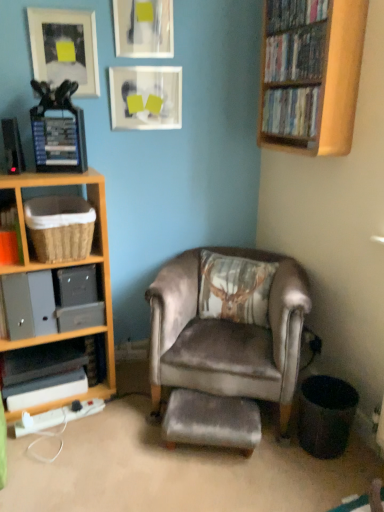
Question: Looking at the image, does wooden bookshelf at upper right seem bigger or smaller compared to woven brown basket at left, the first shelf in the top-to-bottom sequence?

Choices:
 (A) big
 (B) small

Answer: (A)

Question: Is wooden bookshelf at upper right spatially inside woven brown basket at left, which ranks as the 3th shelf in bottom-to-top order, or outside of it?

Choices:
 (A) inside
 (B) outside

Answer: (B)

Question: Estimate the real-world distances between objects in this image. Which object is closer to the matte black picture frame at upper left, placed as the 1th picture frame when sorted from left to right?

Choices:
 (A) velvet brown pillow at center
 (B) wooden shelf at upper right, which is counted as the second book, starting from the bottom
 (C) wooden bookshelf at upper right, the first book when ordered from top to bottom
 (D) matte black books at left, the 3th shelf in the top-to-bottom sequence
 (E) matte glass picture frame at upper center, which ranks as the third picture frame in left-to-right order

Answer: (E)

Question: Which of these objects is positioned farthest from the velvet brown pillow at center?

Choices:
 (A) wooden shelf at upper right, which is counted as the second book, starting from the top
 (B) velvet brown armchair at center
 (C) wooden shelf at left, positioned as the second shelf in top-to-bottom order
 (D) velvet grey footrest at center
 (E) matte black picture frame at upper left, placed as the 1th picture frame when sorted from left to right

Answer: (E)